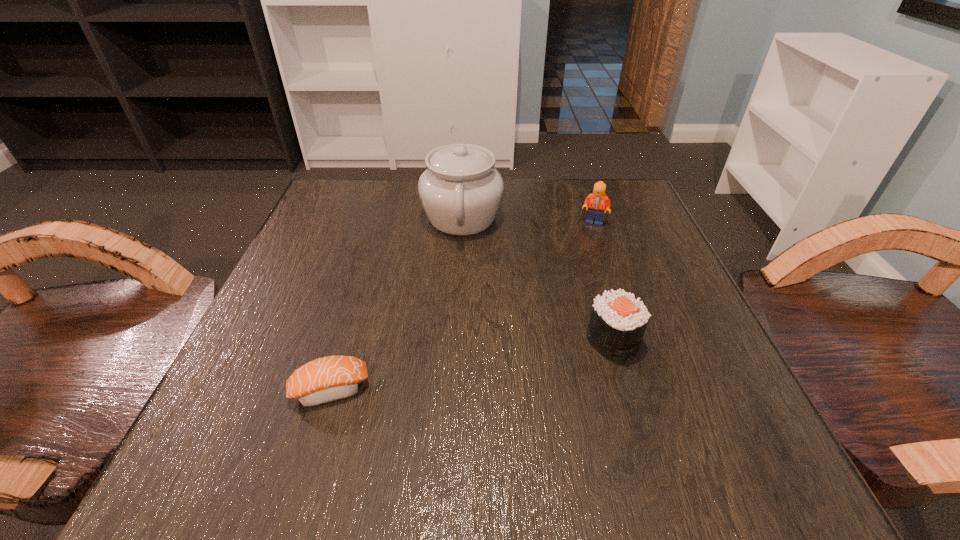
Identify the location of vacant position located on the back of the shortest object. The height and width of the screenshot is (540, 960). (x=347, y=335).

In order to click on chinaware that is positioned at the far edge in this screenshot , I will do `click(461, 191)`.

Where is `Lego that is at the far edge`? Lego that is at the far edge is located at coordinates (597, 201).

The image size is (960, 540). Find the location of `object present at the left edge`. object present at the left edge is located at coordinates (331, 378).

Image resolution: width=960 pixels, height=540 pixels. I want to click on Lego present at the right edge, so click(597, 201).

This screenshot has height=540, width=960. Find the location of `sushi at the right edge`. sushi at the right edge is located at coordinates (618, 321).

The image size is (960, 540). In order to click on object that is at the far right corner in this screenshot , I will do `click(597, 201)`.

Find the location of a particular element. free space at the far edge of the desktop is located at coordinates (530, 194).

The height and width of the screenshot is (540, 960). I want to click on free region at the near edge of the desktop, so click(603, 429).

Where is `vacant area at the left edge of the desktop`? vacant area at the left edge of the desktop is located at coordinates (285, 406).